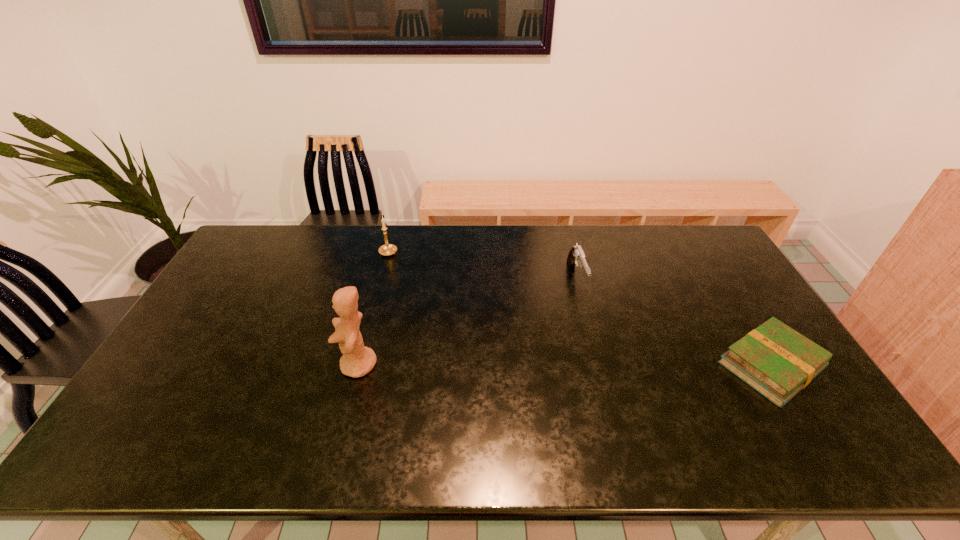
The height and width of the screenshot is (540, 960). Identify the location of free region located 0.340m on the back of the shortest object. (705, 258).

This screenshot has width=960, height=540. Find the location of `vacant area situated 0.320m on the handle side of the candle holder`. vacant area situated 0.320m on the handle side of the candle holder is located at coordinates (452, 303).

This screenshot has height=540, width=960. Find the location of `free point located 0.320m on the handle side of the candle holder`. free point located 0.320m on the handle side of the candle holder is located at coordinates (452, 303).

At what (x,y) coordinates should I click in order to perform the action: click on free location located on the handle side of the candle holder. Please return your answer as a coordinate pair (x, y). The image size is (960, 540). Looking at the image, I should click on (432, 288).

At what (x,y) coordinates should I click in order to perform the action: click on vacant region located 0.120m at the muzzle of the second farthest object. Please return your answer as a coordinate pair (x, y). The image size is (960, 540). Looking at the image, I should click on (593, 327).

The image size is (960, 540). I want to click on vacant area located 0.270m at the muzzle of the second farthest object, so click(x=611, y=367).

Image resolution: width=960 pixels, height=540 pixels. Find the location of `free spot located 0.330m at the muzzle of the second farthest object`. free spot located 0.330m at the muzzle of the second farthest object is located at coordinates (618, 386).

What are the coordinates of `candle holder located in the far edge section of the desktop` in the screenshot? It's located at (388, 249).

Image resolution: width=960 pixels, height=540 pixels. I want to click on gun situated at the far edge, so click(576, 256).

Find the location of a particular element. The height and width of the screenshot is (540, 960). object present at the near edge is located at coordinates point(774,359).